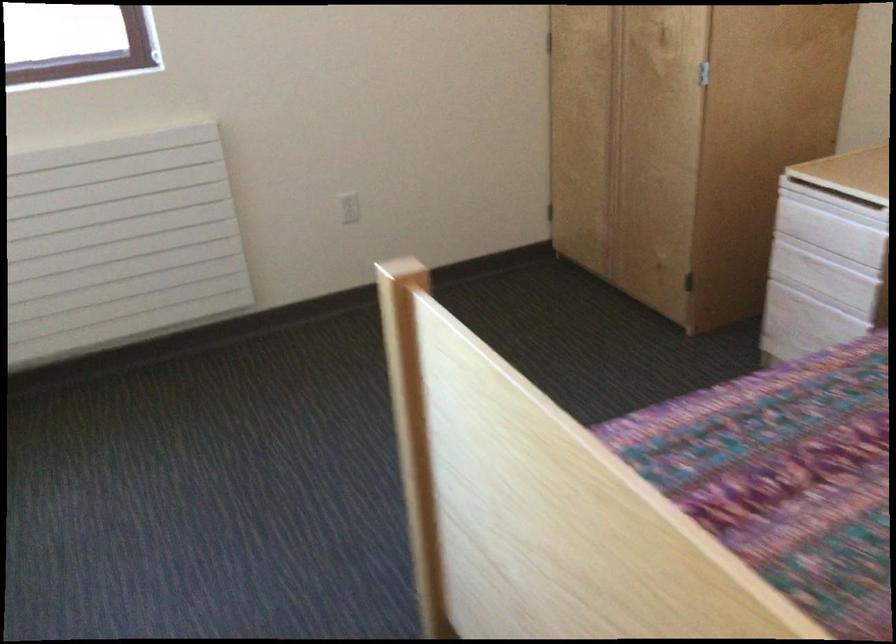
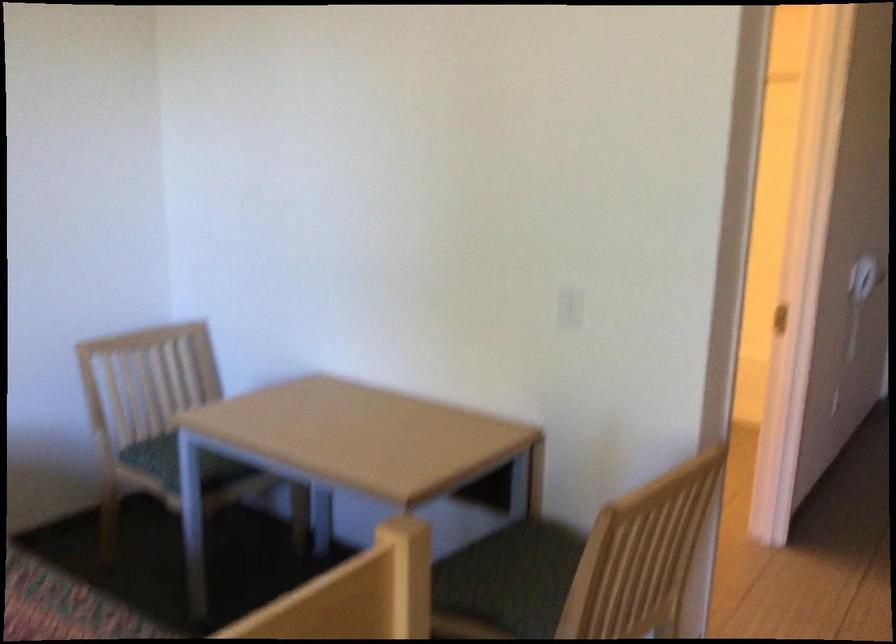
First-person continuous shooting, in which direction is the camera rotating?

The rotation direction of the camera is right-down.